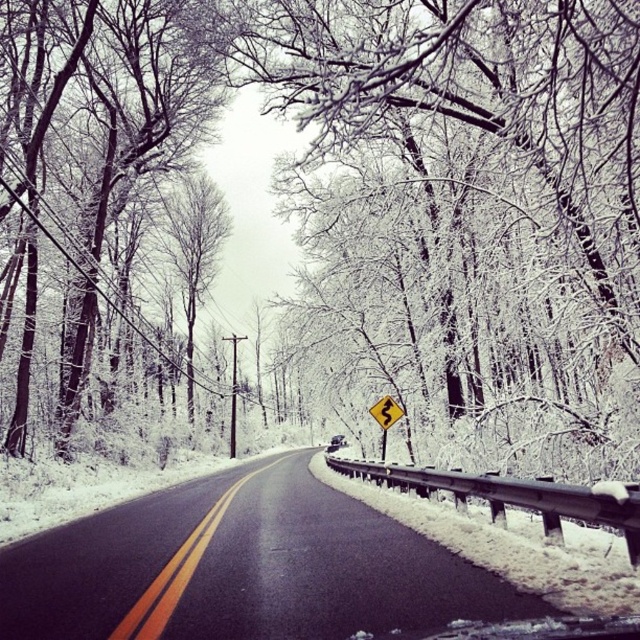
Can you confirm if black asphalt road at center is positioned to the right of yellow reflective plastic at center?

Incorrect, black asphalt road at center is not on the right side of yellow reflective plastic at center.

Between black asphalt road at center and yellow reflective plastic at center, which one is positioned lower?

Positioned lower is black asphalt road at center.

Describe the element at coordinates (243, 566) in the screenshot. I see `black asphalt road at center` at that location.

Identify the location of black asphalt road at center. (243, 566).

Can you confirm if black asphalt road at center is taller than white frosty tree at left?

Incorrect, black asphalt road at center's height is not larger of white frosty tree at left's.

Who is higher up, black asphalt road at center or white frosty tree at left?

white frosty tree at left

Image resolution: width=640 pixels, height=640 pixels. Identify the location of black asphalt road at center. (243, 566).

Who is shorter, white frosty tree at left or yellow reflective plastic at center?

yellow reflective plastic at center is shorter.

Is white frosty tree at left bigger than yellow reflective plastic at center?

Correct, white frosty tree at left is larger in size than yellow reflective plastic at center.

The image size is (640, 640). Find the location of `white frosty tree at left`. white frosty tree at left is located at coordinates (93, 147).